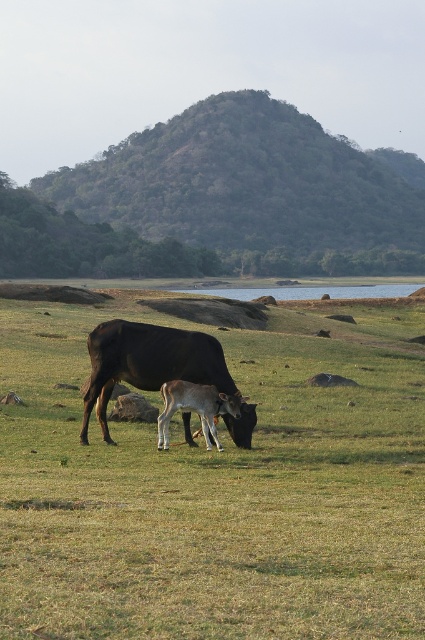
Question: Does green grassy field at center appear on the right side of white smooth calf at center?

Choices:
 (A) no
 (B) yes

Answer: (A)

Question: Which point is farther to the camera?

Choices:
 (A) clear water at center
 (B) shiny black cow at center

Answer: (A)

Question: Does green grassy field at center appear on the right side of white smooth calf at center?

Choices:
 (A) yes
 (B) no

Answer: (B)

Question: Which point appears farthest from the camera in this image?

Choices:
 (A) (158, 426)
 (B) (146, 356)

Answer: (A)

Question: Which object is the farthest from the green grassy field at center?

Choices:
 (A) shiny black cow at center
 (B) white smooth calf at center

Answer: (A)

Question: Does shiny black cow at center have a smaller size compared to clear water at center?

Choices:
 (A) no
 (B) yes

Answer: (B)